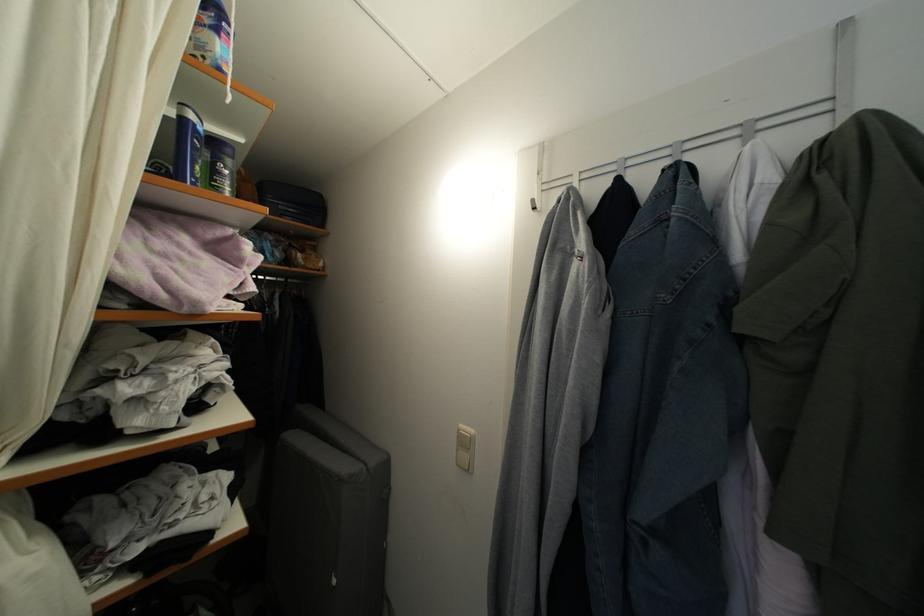
The height and width of the screenshot is (616, 924). In order to click on white coat hook in this screenshot , I will do `click(538, 179)`.